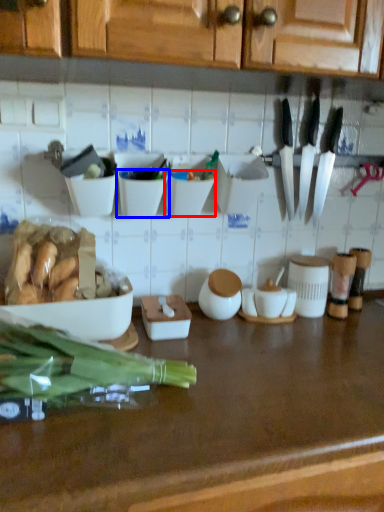
Question: Which object appears closest to the camera in this image, bowl (highlighted by a red box) or bowl (highlighted by a blue box)?

Choices:
 (A) bowl
 (B) bowl

Answer: (B)